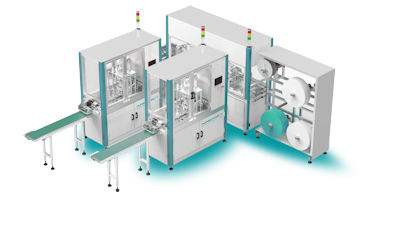
The width and height of the screenshot is (400, 227). Find the location of `screen`. screen is located at coordinates (219, 82), (154, 62).